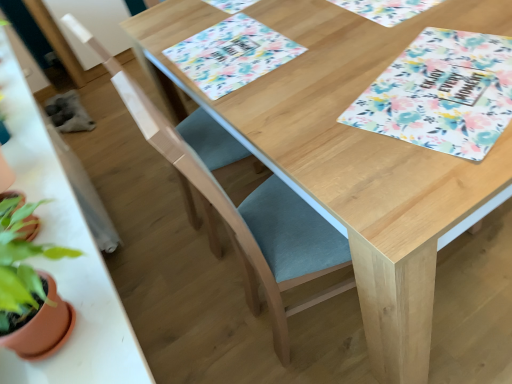
Identify the location of wooden table at left. (64, 259).

The width and height of the screenshot is (512, 384). I want to click on teal fabric folding chair at center, the first folding chair viewed from the back, so click(x=211, y=140).

Identify the location of light blue fabric folding chair at center, the 2th folding chair viewed from the back. The image size is (512, 384). (253, 222).

The image size is (512, 384). Identify the location of floral fabric placemat at upper center, marked as the first place mat in a right-to-left arrangement. (x=386, y=9).

Is there a large distance between floral fabric placemat at upper right and light blue fabric folding chair at center, the 1th folding chair in the front-to-back sequence?

No.

Could you tell me if floral fabric placemat at upper right is facing light blue fabric folding chair at center, the 2th folding chair viewed from the back?

No, floral fabric placemat at upper right is not facing towards light blue fabric folding chair at center, the 2th folding chair viewed from the back.

Where is `tablecloth that appears on the right of light blue fabric folding chair at center, the 1th folding chair in the front-to-back sequence`? tablecloth that appears on the right of light blue fabric folding chair at center, the 1th folding chair in the front-to-back sequence is located at coordinates (442, 94).

Considering the relative positions of floral paper placemat at center, the first place mat viewed from the left, and floral fabric placemat at upper center, which is the 2th place mat in left-to-right order, in the image provided, is floral paper placemat at center, the first place mat viewed from the left, to the left or to the right of floral fabric placemat at upper center, which is the 2th place mat in left-to-right order,?

floral paper placemat at center, the first place mat viewed from the left, is to the left of floral fabric placemat at upper center, which is the 2th place mat in left-to-right order.

Would you say floral paper placemat at center, the first place mat viewed from the left, contains floral fabric placemat at upper center, which is the 2th place mat in left-to-right order?

No, floral fabric placemat at upper center, which is the 2th place mat in left-to-right order, is not surrounded by floral paper placemat at center, the first place mat viewed from the left.

Who is taller, floral paper placemat at center, the first place mat viewed from the left, or floral fabric placemat at upper center, which is the 2th place mat in left-to-right order?

Standing taller between the two is floral fabric placemat at upper center, which is the 2th place mat in left-to-right order.

From the image's perspective, is floral paper placemat at center, the first place mat viewed from the left, over floral fabric placemat at upper center, which is the 2th place mat in left-to-right order?

No, from the image's perspective, floral paper placemat at center, the first place mat viewed from the left, is not above floral fabric placemat at upper center, which is the 2th place mat in left-to-right order.

Which is more to the right, floral paper placemat at center, which is the 2th place mat from right to left, or wooden table at left?

floral paper placemat at center, which is the 2th place mat from right to left.

Considering the sizes of floral paper placemat at center, which is the 2th place mat from right to left, and wooden table at left in the image, is floral paper placemat at center, which is the 2th place mat from right to left, taller or shorter than wooden table at left?

Considering their sizes, floral paper placemat at center, which is the 2th place mat from right to left, has less height than wooden table at left.

Which object is wider, floral paper placemat at center, which is the 2th place mat from right to left, or wooden table at left?

floral paper placemat at center, which is the 2th place mat from right to left.

Can teal fabric folding chair at center, the first folding chair viewed from the back, be found inside floral fabric placemat at upper right?

No, teal fabric folding chair at center, the first folding chair viewed from the back, is located outside of floral fabric placemat at upper right.

Can you confirm if floral fabric placemat at upper right is positioned to the left of teal fabric folding chair at center, placed as the 2th folding chair when sorted from front to back?

No, floral fabric placemat at upper right is not to the left of teal fabric folding chair at center, placed as the 2th folding chair when sorted from front to back.

From a real-world perspective, does floral fabric placemat at upper right stand above teal fabric folding chair at center, the first folding chair viewed from the back?

Yes.

Which of these two, floral fabric placemat at upper center, marked as the first place mat in a right-to-left arrangement, or teal fabric folding chair at center, placed as the 2th folding chair when sorted from front to back, stands taller?

Standing taller between the two is teal fabric folding chair at center, placed as the 2th folding chair when sorted from front to back.

Does floral fabric placemat at upper center, marked as the first place mat in a right-to-left arrangement, have a lesser width compared to teal fabric folding chair at center, placed as the 2th folding chair when sorted from front to back?

Yes.

Based on their sizes in the image, would you say floral fabric placemat at upper center, marked as the first place mat in a right-to-left arrangement, is bigger or smaller than teal fabric folding chair at center, placed as the 2th folding chair when sorted from front to back?

In the image, floral fabric placemat at upper center, marked as the first place mat in a right-to-left arrangement, appears to be smaller than teal fabric folding chair at center, placed as the 2th folding chair when sorted from front to back.

Is floral fabric placemat at upper center, which is the 2th place mat in left-to-right order, inside the boundaries of teal fabric folding chair at center, placed as the 2th folding chair when sorted from front to back, or outside?

floral fabric placemat at upper center, which is the 2th place mat in left-to-right order, is not inside teal fabric folding chair at center, placed as the 2th folding chair when sorted from front to back, it's outside.

Is teal fabric folding chair at center, the first folding chair viewed from the back, positioned far away from floral paper placemat at center, which is the 2th place mat from right to left?

Actually, teal fabric folding chair at center, the first folding chair viewed from the back, and floral paper placemat at center, which is the 2th place mat from right to left, are a little close together.

Is teal fabric folding chair at center, placed as the 2th folding chair when sorted from front to back, oriented away from floral paper placemat at center, which is the 2th place mat from right to left?

Correct, teal fabric folding chair at center, placed as the 2th folding chair when sorted from front to back, is looking away from floral paper placemat at center, which is the 2th place mat from right to left.

Between teal fabric folding chair at center, placed as the 2th folding chair when sorted from front to back, and floral paper placemat at center, the first place mat viewed from the left, which one is positioned behind?

floral paper placemat at center, the first place mat viewed from the left, is further away from the camera.

Between wooden table at left and light blue fabric folding chair at center, the 1th folding chair in the front-to-back sequence, which one is positioned in front?

wooden table at left is more forward.

Where is `folding chair that is the 1st one below the wooden table at left (from a real-world perspective)`? Image resolution: width=512 pixels, height=384 pixels. folding chair that is the 1st one below the wooden table at left (from a real-world perspective) is located at coordinates (253, 222).

Is wooden table at left at the left side of light blue fabric folding chair at center, the 1th folding chair in the front-to-back sequence?

Yes.

From a real-world perspective, is wooden table at left over light blue fabric folding chair at center, the 1th folding chair in the front-to-back sequence?

Indeed, from a real-world perspective, wooden table at left stands above light blue fabric folding chair at center, the 1th folding chair in the front-to-back sequence.

The width and height of the screenshot is (512, 384). In the image, there is a light blue fabric folding chair at center, the 2th folding chair viewed from the back. What are the coordinates of `tablecloth above it (from the image's perspective)` in the screenshot? It's located at (442, 94).

Where is `place mat in front of the floral fabric placemat at upper center, marked as the first place mat in a right-to-left arrangement`? The height and width of the screenshot is (384, 512). place mat in front of the floral fabric placemat at upper center, marked as the first place mat in a right-to-left arrangement is located at coordinates (231, 54).

From the image, which object appears to be farther from teal fabric folding chair at center, placed as the 2th folding chair when sorted from front to back, wooden table at left or floral fabric placemat at upper right?

floral fabric placemat at upper right is positioned further to the anchor teal fabric folding chair at center, placed as the 2th folding chair when sorted from front to back.

Estimate the real-world distances between objects in this image. Which object is further from floral fabric placemat at upper center, which is the 2th place mat in left-to-right order, teal fabric folding chair at center, the first folding chair viewed from the back, or light blue fabric folding chair at center, the 2th folding chair viewed from the back?

The object further to floral fabric placemat at upper center, which is the 2th place mat in left-to-right order, is light blue fabric folding chair at center, the 2th folding chair viewed from the back.

Considering their positions, is wooden table at left positioned closer to light blue fabric folding chair at center, the 1th folding chair in the front-to-back sequence, than floral fabric placemat at upper center, marked as the first place mat in a right-to-left arrangement?

The object closer to light blue fabric folding chair at center, the 1th folding chair in the front-to-back sequence, is wooden table at left.

Based on their spatial positions, is floral fabric placemat at upper center, marked as the first place mat in a right-to-left arrangement, or floral paper placemat at center, the first place mat viewed from the left, closer to floral fabric placemat at upper right?

floral fabric placemat at upper center, marked as the first place mat in a right-to-left arrangement, is closer to floral fabric placemat at upper right.

From the image, which object appears to be farther from light blue fabric folding chair at center, the 1th folding chair in the front-to-back sequence, floral paper placemat at center, which is the 2th place mat from right to left, or teal fabric folding chair at center, the first folding chair viewed from the back?

Based on the image, floral paper placemat at center, which is the 2th place mat from right to left, appears to be further to light blue fabric folding chair at center, the 1th folding chair in the front-to-back sequence.

When comparing their distances from floral paper placemat at center, which is the 2th place mat from right to left, does wooden table at left or floral fabric placemat at upper right seem further?

wooden table at left is further to floral paper placemat at center, which is the 2th place mat from right to left.

Based on their spatial positions, is wooden table at left or teal fabric folding chair at center, the first folding chair viewed from the back, closer to light blue fabric folding chair at center, the 1th folding chair in the front-to-back sequence?

teal fabric folding chair at center, the first folding chair viewed from the back, is closer to light blue fabric folding chair at center, the 1th folding chair in the front-to-back sequence.

Considering their positions, is floral paper placemat at center, the first place mat viewed from the left, positioned further to wooden table at left than floral fabric placemat at upper right?

Among the two, floral fabric placemat at upper right is located further to wooden table at left.

This screenshot has width=512, height=384. What are the coordinates of `place mat between floral fabric placemat at upper center, which is the 2th place mat in left-to-right order, and light blue fabric folding chair at center, the 1th folding chair in the front-to-back sequence, in the up-down direction` in the screenshot? It's located at (231, 54).

Identify the location of tablecloth between light blue fabric folding chair at center, the 2th folding chair viewed from the back, and floral paper placemat at center, the first place mat viewed from the left, from front to back. This screenshot has width=512, height=384. (442, 94).

Where is `folding chair between teal fabric folding chair at center, placed as the 2th folding chair when sorted from front to back, and floral fabric placemat at upper right from left to right`? The image size is (512, 384). folding chair between teal fabric folding chair at center, placed as the 2th folding chair when sorted from front to back, and floral fabric placemat at upper right from left to right is located at coordinates (253, 222).

This screenshot has width=512, height=384. What are the coordinates of `folding chair situated between wooden table at left and floral paper placemat at center, the first place mat viewed from the left, from left to right` in the screenshot? It's located at (211, 140).